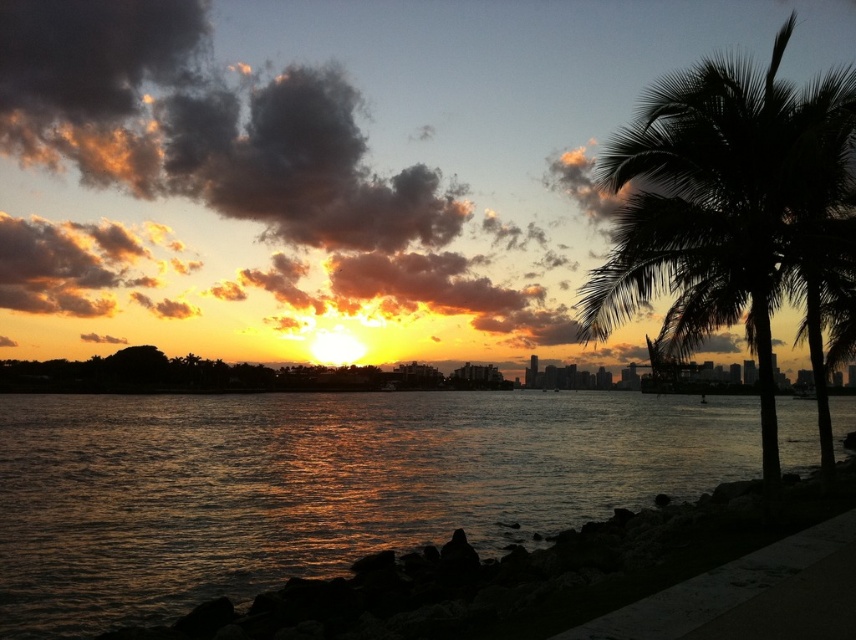
Question: Is glistening water at lower left positioned in front of silhouette leafy palm at right?

Choices:
 (A) no
 (B) yes

Answer: (A)

Question: Does glistening water at lower left have a larger size compared to silhouette leafy palm at right?

Choices:
 (A) yes
 (B) no

Answer: (B)

Question: Which point appears closest to the camera in this image?

Choices:
 (A) click(617, 412)
 (B) click(703, 148)

Answer: (B)

Question: Among these points, which one is nearest to the camera?

Choices:
 (A) (204, 406)
 (B) (767, 305)

Answer: (B)

Question: Which point is closer to the camera?

Choices:
 (A) glistening water at lower left
 (B) silhouette leafy palm at right

Answer: (B)

Question: Can you confirm if glistening water at lower left is smaller than silhouette leafy palm at right?

Choices:
 (A) yes
 (B) no

Answer: (A)